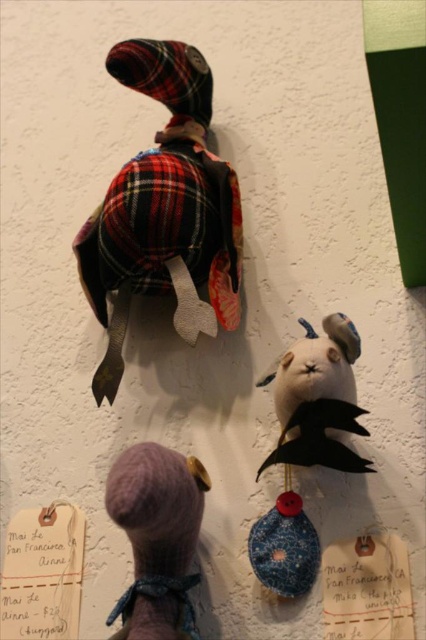
Can you confirm if plaid fabric duck at upper left is positioned to the left of fuzzy pink doll at lower left?

Incorrect, plaid fabric duck at upper left is not on the left side of fuzzy pink doll at lower left.

Which of these two, plaid fabric duck at upper left or fuzzy pink doll at lower left, stands shorter?

fuzzy pink doll at lower left

Who is more distant from viewer, (212, 161) or (118, 458)?

The point (118, 458) is behind.

Identify the location of plaid fabric duck at upper left. This screenshot has height=640, width=426. (164, 211).

Can you confirm if fuzzy pink doll at lower left is thinner than felt rabbit at center?

No.

Is point (124, 596) positioned after point (325, 420)?

Yes.

The image size is (426, 640). I want to click on fuzzy pink doll at lower left, so click(x=157, y=538).

Does plaid fabric duck at upper left appear on the right side of felt rabbit at center?

In fact, plaid fabric duck at upper left is to the left of felt rabbit at center.

Locate an element on the screen. The height and width of the screenshot is (640, 426). plaid fabric duck at upper left is located at coordinates click(164, 211).

Identify the location of plaid fabric duck at upper left. (164, 211).

I want to click on plaid fabric duck at upper left, so click(x=164, y=211).